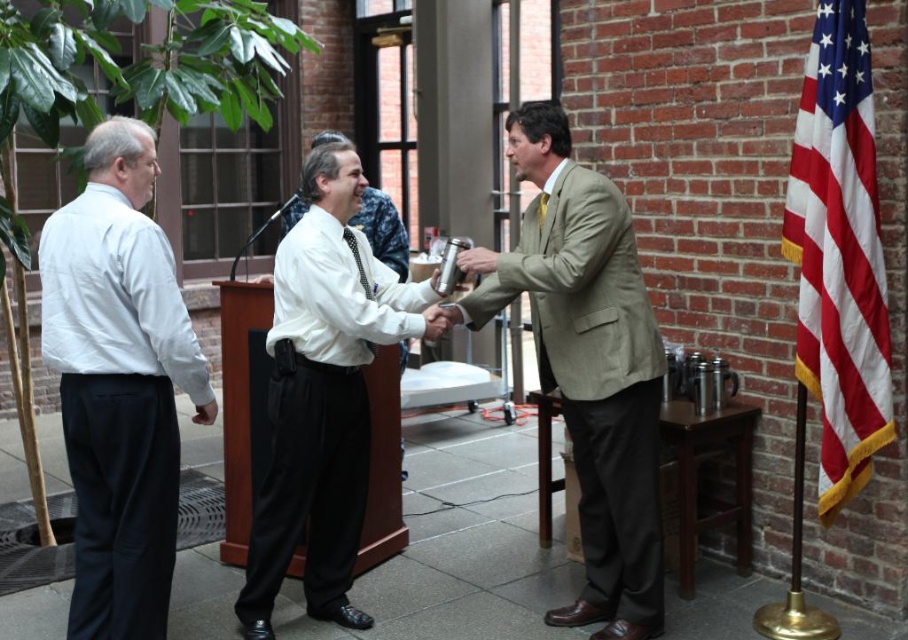
Consider the image. You are standing at the center of the image. Which direction should you move to get closer to the white cotton shirt at left?

Since the white cotton shirt at left is located at point 0.600 on the x axis and 0.132 on the y axis, you should move to the left to get closer to it.

You are a photographer positioned behind the three men. You need to capture a closeup shot of both the white shirt at center and the matte black tie at center in the same frame. Can you adjust your camera to focus on both objects simultaneously given their distance apart?

The distance between the white shirt at center and the matte black tie at center is 1.04 meters. Since the camera can focus on objects within a 1.5 meter range in the same frame, you can adjust your camera to focus on both objects simultaneously.

You are a photographer positioned at the front of the scene. You want to capture a closeup of both point (352, 252) and point (548, 195) in your shot. Which point should you focus on first to ensure both are in focus?

You should focus on point (352, 252) first because it is closer to the camera than point (548, 195). By focusing on the closer point, the farther point will also be within the depth of field, ensuring both are in focus.